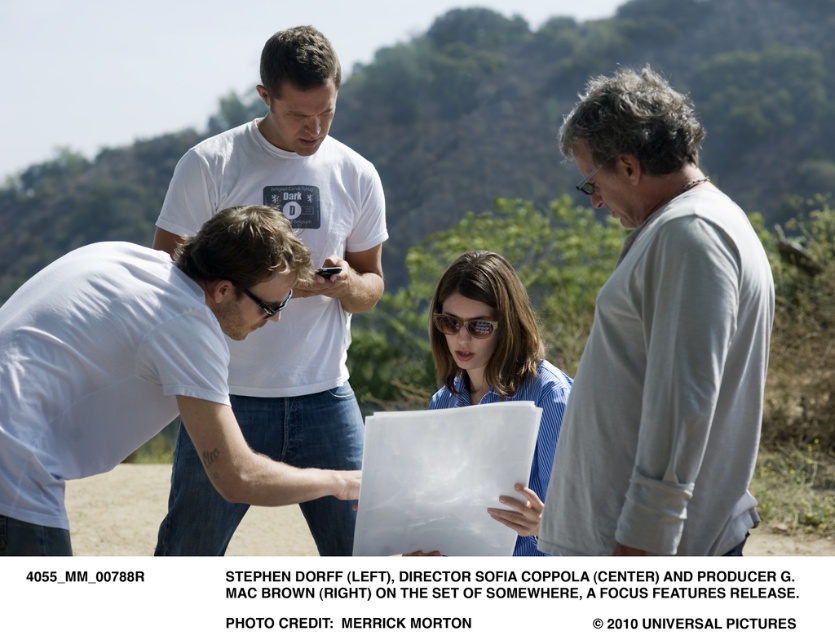
Question: Estimate the real-world distances between objects in this image. Which object is closer to the blue striped shirt at center?

Choices:
 (A) brown reflective sunglasses at center
 (B) white matte t-shirt at center
 (C) matte black goggles at center

Answer: (A)

Question: Does white t-shirt at upper center appear on the right side of blue striped shirt at center?

Choices:
 (A) yes
 (B) no

Answer: (B)

Question: Which of the following is the closest to the observer?

Choices:
 (A) (251, 136)
 (B) (466, 323)
 (C) (514, 314)
 (D) (658, 198)

Answer: (D)

Question: In this image, where is blue striped shirt at center located relative to matte black goggles at center?

Choices:
 (A) above
 (B) below

Answer: (B)

Question: Among these points, which one is farthest from the camera?

Choices:
 (A) (655, 173)
 (B) (449, 285)
 (C) (491, 324)

Answer: (B)

Question: Is white t-shirt at upper center above blue striped shirt at center?

Choices:
 (A) yes
 (B) no

Answer: (A)